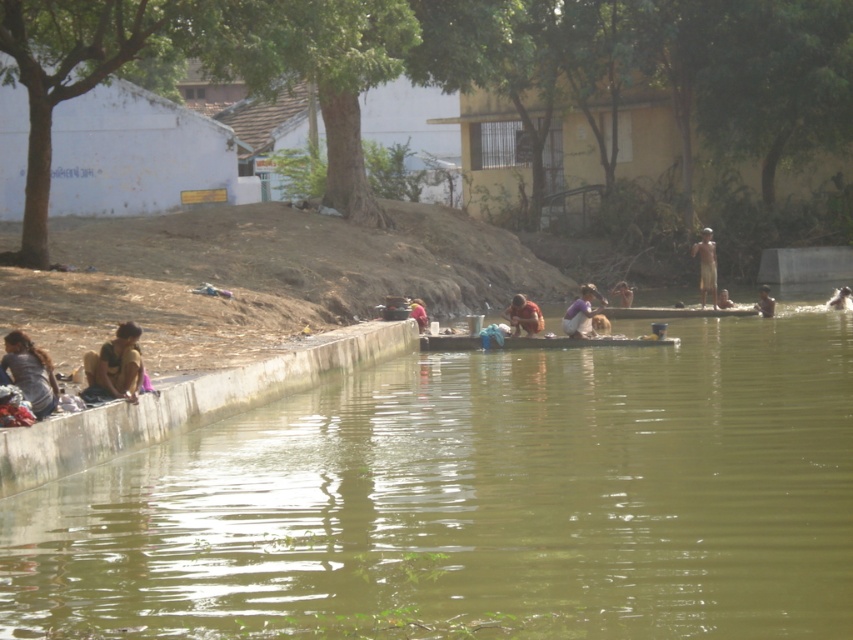
Based on the photo, measure the distance between dark gray fabric at lower left and brown woven cloth at center.

dark gray fabric at lower left is 22.93 meters from brown woven cloth at center.

Does dark gray fabric at lower left have a larger size compared to brown woven cloth at center?

No, dark gray fabric at lower left is not bigger than brown woven cloth at center.

Is point (36, 368) positioned before point (712, 250)?

Yes, point (36, 368) is in front of point (712, 250).

Locate an element on the screen. This screenshot has height=640, width=853. dark gray fabric at lower left is located at coordinates (30, 372).

Which is more to the right, brown fabric cloth at lower left or orange fabric person at center?

orange fabric person at center

Who is higher up, brown fabric cloth at lower left or orange fabric person at center?

orange fabric person at center

Locate an element on the screen. brown fabric cloth at lower left is located at coordinates coord(114,365).

You are a GUI agent. You are given a task and a screenshot of the screen. Output one action in this format:
    pyautogui.click(x=<x>, y=<y>)
    Task: Click on the concrete ledge at lower left
    This screenshot has height=640, width=853.
    Given the screenshot: What is the action you would take?
    pyautogui.click(x=187, y=404)

Who is shorter, concrete ledge at lower left or light brown skin at upper right?

light brown skin at upper right

Which is behind, point (416, 340) or point (717, 298)?

The point (717, 298) is behind.

The image size is (853, 640). Find the location of `concrete ledge at lower left`. concrete ledge at lower left is located at coordinates (187, 404).